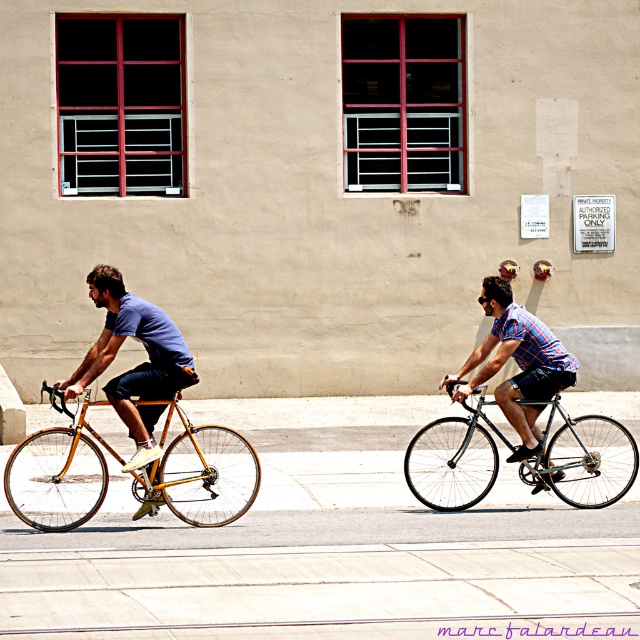
Question: Which point is farther from the camera taking this photo?

Choices:
 (A) (74, 490)
 (B) (525, 416)
 (C) (620, 492)
 (D) (145, 452)

Answer: (A)

Question: Is matte gold bicycle at left to the right of plaid cotton shirt at center from the viewer's perspective?

Choices:
 (A) yes
 (B) no

Answer: (B)

Question: Is gold metallic bicycle at left thinner than plaid cotton shirt at center?

Choices:
 (A) no
 (B) yes

Answer: (A)

Question: Which point is closer to the camera?

Choices:
 (A) shiny silver bicycle at right
 (B) gold metallic bicycle at left

Answer: (B)

Question: Which object is the farthest from the gold metallic bicycle at left?

Choices:
 (A) shiny silver bicycle at right
 (B) matte gold bicycle at left
 (C) plaid cotton shirt at center

Answer: (A)

Question: Can you confirm if gold metallic bicycle at left is positioned below plaid cotton shirt at center?

Choices:
 (A) yes
 (B) no

Answer: (A)